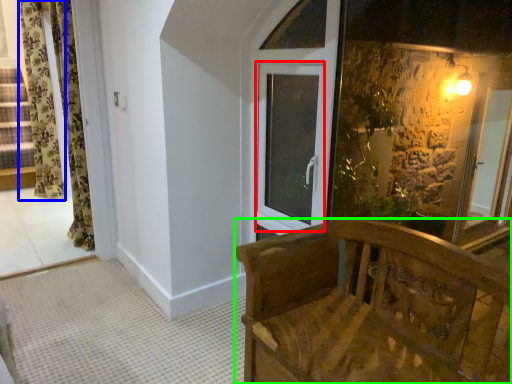
Question: Estimate the real-world distances between objects in this image. Which object is farther from window (highlighted by a red box), curtain (highlighted by a blue box) or furniture (highlighted by a green box)?

Choices:
 (A) curtain
 (B) furniture

Answer: (A)